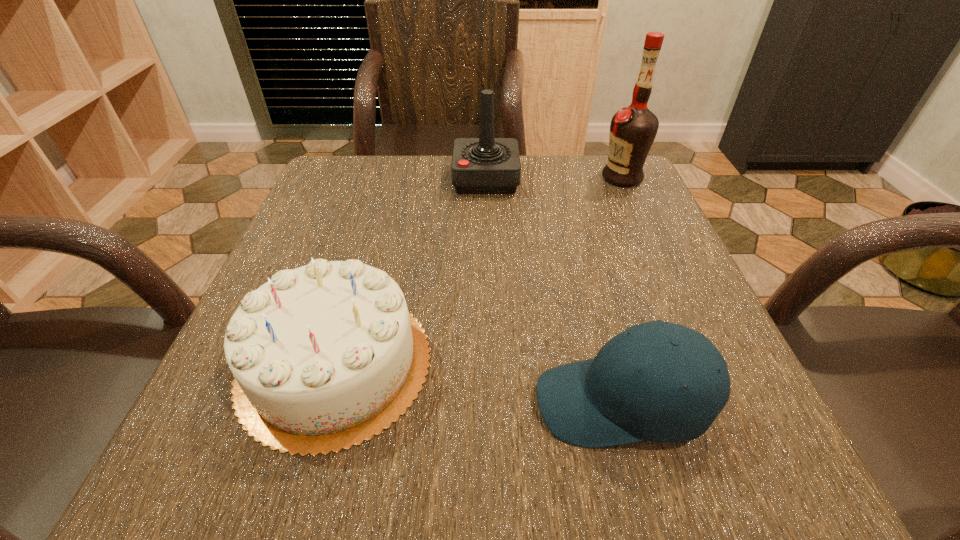
The image size is (960, 540). What are the coordinates of `liquor at the right edge` in the screenshot? It's located at (633, 129).

Where is `baseball cap that is positioned at the right edge`? This screenshot has width=960, height=540. baseball cap that is positioned at the right edge is located at coordinates (605, 401).

The height and width of the screenshot is (540, 960). What are the coordinates of `object that is at the near left corner` in the screenshot? It's located at (325, 356).

Find the location of a particular element. object positioned at the far right corner is located at coordinates (633, 129).

At what (x,y) coordinates should I click in order to perform the action: click on object situated at the near right corner. Please return your answer as a coordinate pair (x, y). Looking at the image, I should click on (605, 401).

This screenshot has width=960, height=540. Find the location of `vacant space at the far edge of the desktop`. vacant space at the far edge of the desktop is located at coordinates (419, 156).

Where is `vacant space at the near edge of the desktop`? The width and height of the screenshot is (960, 540). vacant space at the near edge of the desktop is located at coordinates (448, 475).

You are a GUI agent. You are given a task and a screenshot of the screen. Output one action in this format:
    pyautogui.click(x=<x>, y=<y>)
    Task: Click on the vacant space at the right edge of the desktop
    This screenshot has width=960, height=540.
    Given the screenshot: What is the action you would take?
    pyautogui.click(x=670, y=244)

This screenshot has width=960, height=540. I want to click on vacant area at the far left corner of the desktop, so click(x=359, y=180).

You are a GUI agent. You are given a task and a screenshot of the screen. Output one action in this format:
    pyautogui.click(x=<x>, y=<y>)
    Task: Click on the vacant space at the near left corner of the desktop
    
    Given the screenshot: What is the action you would take?
    pyautogui.click(x=210, y=432)